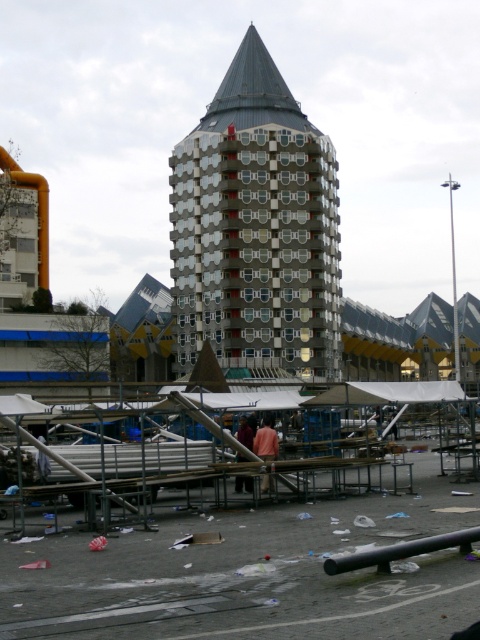
You are a city planner assessing the urban layout. You need to determine if the metal scaffolding at center can be removed to allow more space for pedestrians around the metallic gray building at center. Based on the spatial relationship between them, is this feasible?

The metal scaffolding at center occupies less space than the metallic gray building at center, so removing it would free up space, making it feasible to allow more pedestrian area around the metallic gray building at center.

You are an urban planner reviewing the image of the city. You notice the metal scaffolding at center and the metallic gray building at center. Which object is positioned further to the east in the scene?

The metal scaffolding at center is to the right of the metallic gray building at center, so it is positioned further to the east in the scene.